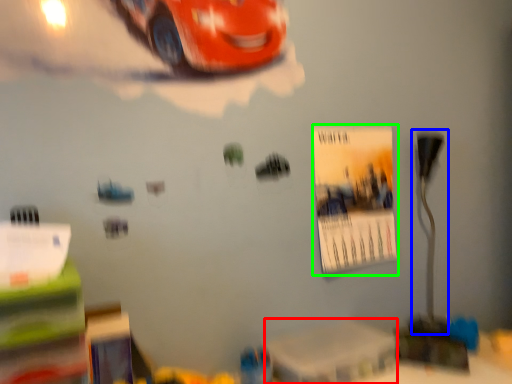
Question: Estimate the real-world distances between objects in this image. Which object is closer to table (highlighted by a red box), table lamp (highlighted by a blue box) or poster page (highlighted by a green box)?

Choices:
 (A) table lamp
 (B) poster page

Answer: (B)